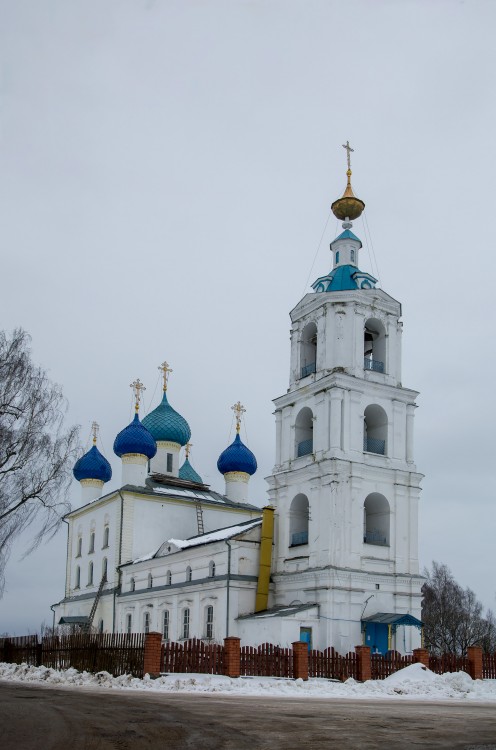
Where is `door`? The width and height of the screenshot is (496, 750). door is located at coordinates (305, 633).